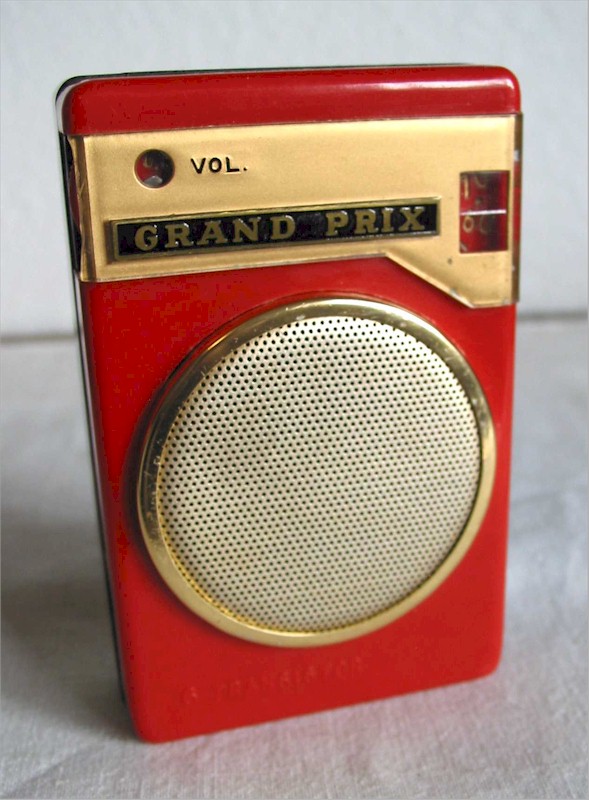
Locate an element on the screen. The height and width of the screenshot is (800, 589). speaker is located at coordinates (306, 577).